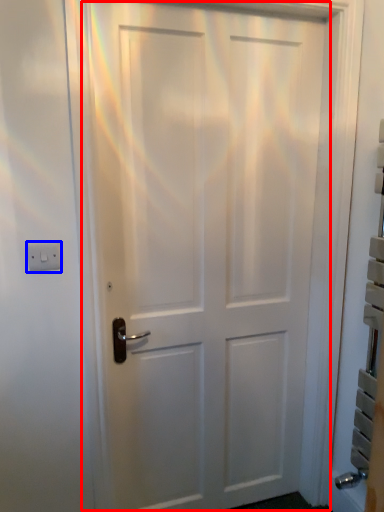
Question: Which of the following is the closest to the observer, door (highlighted by a red box) or light switch (highlighted by a blue box)?

Choices:
 (A) door
 (B) light switch

Answer: (A)